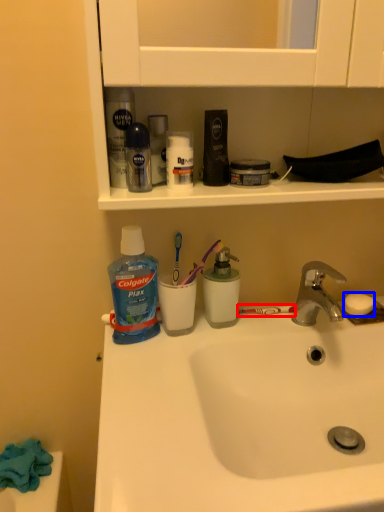
Question: Among these objects, which one is farthest to the camera, toothbrush (highlighted by a red box) or soap (highlighted by a blue box)?

Choices:
 (A) toothbrush
 (B) soap

Answer: (A)